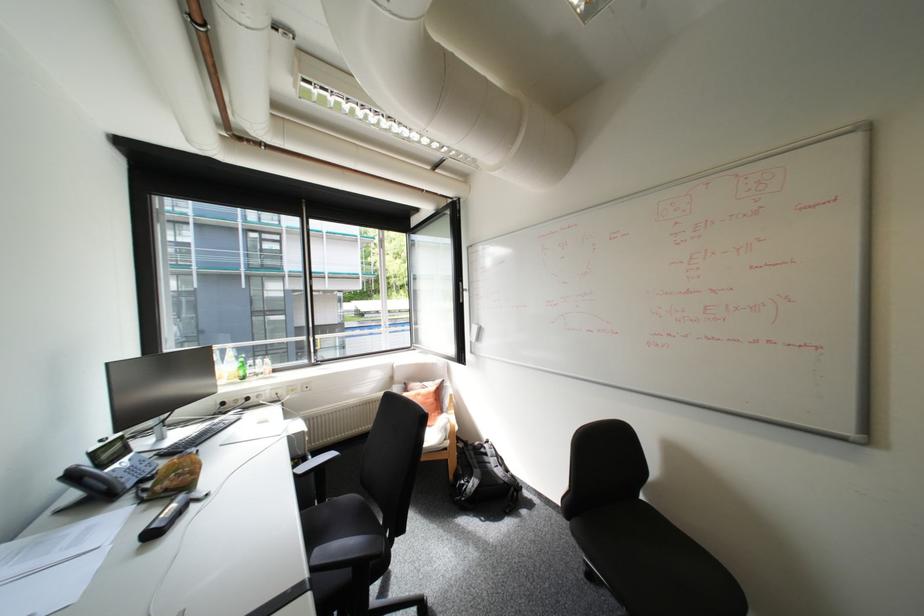
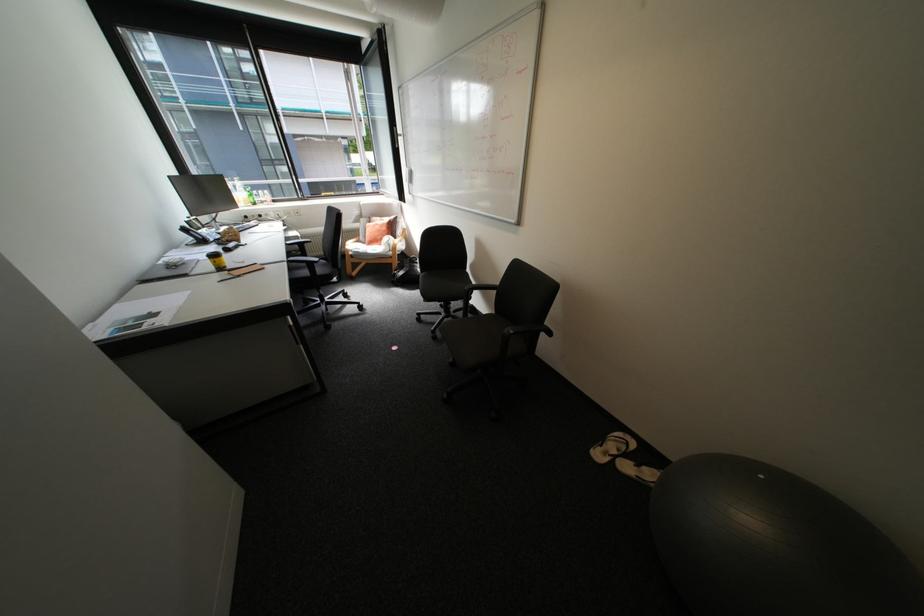
Question: I am providing you with two images of the same scene from different viewpoints. Which of the following objects are not visible in image2?

Choices:
 (A) telephone handset
 (B) green plastic bottle
 (C) gray exercise ball
 (D) none of these

Answer: (D)